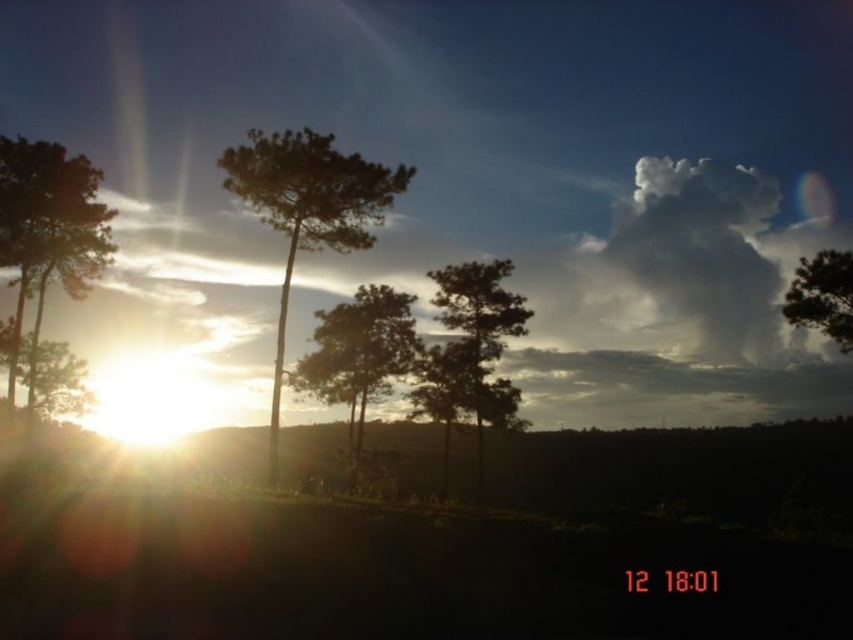
Question: Is green leafy tree at center thinner than green matte tree at upper right?

Choices:
 (A) yes
 (B) no

Answer: (B)

Question: Which object is closer to the camera taking this photo?

Choices:
 (A) green matte tree at upper right
 (B) matte green tree at left

Answer: (A)

Question: Which point is closer to the camera?

Choices:
 (A) silhouette wood tree at left
 (B) silhouette wood tree at center
 (C) green leafy tree at center
 (D) matte green tree at left

Answer: (C)

Question: Can you confirm if silhouette wood tree at left is positioned to the right of green matte tree at upper right?

Choices:
 (A) yes
 (B) no

Answer: (B)

Question: Is green matte tree at center below matte green tree at left?

Choices:
 (A) no
 (B) yes

Answer: (B)

Question: Which point is closer to the camera taking this photo?

Choices:
 (A) (438, 289)
 (B) (238, 145)
 (C) (399, 369)
 (D) (813, 305)

Answer: (D)